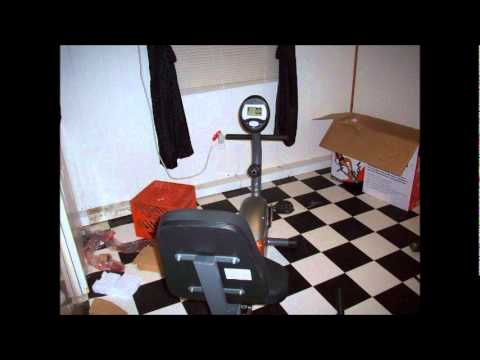
You are a GUI agent. You are given a task and a screenshot of the screen. Output one action in this format:
    pyautogui.click(x=<x>, y=<y>)
    Task: Click on the venetian blinds
    
    Given the screenshot: What is the action you would take?
    pyautogui.click(x=223, y=62)